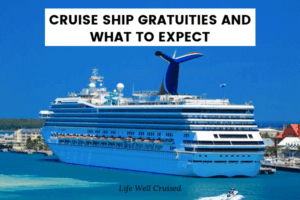
Find the location of a particular element. This screenshot has width=300, height=200. windows is located at coordinates 148,132, 103,131, 60,129.